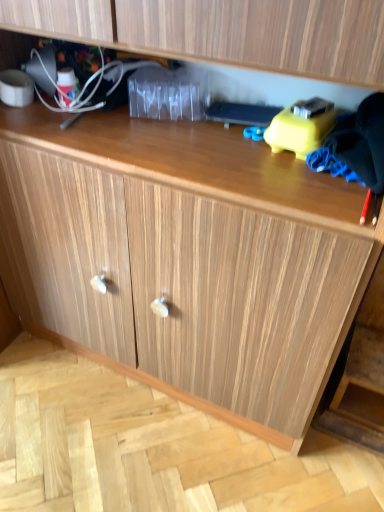
The width and height of the screenshot is (384, 512). What do you see at coordinates (356, 146) in the screenshot? I see `black fabric at right` at bounding box center [356, 146].

I want to click on black fabric at right, so click(x=356, y=146).

What are the coordinates of `yellow plastic toy at upper right` in the screenshot? It's located at (301, 127).

Describe the element at coordinates (301, 127) in the screenshot. I see `yellow plastic toy at upper right` at that location.

Where is `black fabric at right`? The image size is (384, 512). black fabric at right is located at coordinates (356, 146).

Can you confirm if black fabric at right is positioned to the right of yellow plastic toy at upper right?

Indeed, black fabric at right is positioned on the right side of yellow plastic toy at upper right.

Considering the positions of objects black fabric at right and yellow plastic toy at upper right in the image provided, who is behind, black fabric at right or yellow plastic toy at upper right?

yellow plastic toy at upper right is more distant.

Considering the positions of point (339, 118) and point (317, 106), is point (339, 118) closer or farther from the camera than point (317, 106)?

Clearly, point (339, 118) is more distant from the camera than point (317, 106).

From the image's perspective, who appears lower, black fabric at right or yellow plastic toy at upper right?

From the image's view, black fabric at right is below.

From a real-world perspective, which object rests below the other?

yellow plastic toy at upper right is physically lower.

Can you confirm if black fabric at right is thinner than yellow plastic toy at upper right?

In fact, black fabric at right might be wider than yellow plastic toy at upper right.

Does black fabric at right have a greater height compared to yellow plastic toy at upper right?

Yes, black fabric at right is taller than yellow plastic toy at upper right.

Can you confirm if black fabric at right is bigger than yellow plastic toy at upper right?

Correct, black fabric at right is larger in size than yellow plastic toy at upper right.

Do you think black fabric at right is within yellow plastic toy at upper right, or outside of it?

black fabric at right cannot be found inside yellow plastic toy at upper right.

Is black fabric at right positioned far away from yellow plastic toy at upper right?

Actually, black fabric at right and yellow plastic toy at upper right are a little close together.

Is black fabric at right turned away from yellow plastic toy at upper right?

black fabric at right does not have its back to yellow plastic toy at upper right.

Where is `clothing that appears on the right of yellow plastic toy at upper right`? The width and height of the screenshot is (384, 512). clothing that appears on the right of yellow plastic toy at upper right is located at coordinates (356, 146).

Can you confirm if yellow plastic toy at upper right is positioned to the left of black fabric at right?

Yes, yellow plastic toy at upper right is to the left of black fabric at right.

Which object is more forward, yellow plastic toy at upper right or black fabric at right?

black fabric at right is in front.

Considering the points (286, 111) and (382, 108), which point is behind, point (286, 111) or point (382, 108)?

The point (286, 111) is farther from the camera.

From the image's perspective, is yellow plastic toy at upper right beneath black fabric at right?

No, from the image's perspective, yellow plastic toy at upper right is not below black fabric at right.

From a real-world perspective, is yellow plastic toy at upper right over black fabric at right?

No, from a real-world perspective, yellow plastic toy at upper right is not over black fabric at right

Which object is wider, yellow plastic toy at upper right or black fabric at right?

black fabric at right.

Considering the sizes of objects yellow plastic toy at upper right and black fabric at right in the image provided, who is taller, yellow plastic toy at upper right or black fabric at right?

black fabric at right.

Looking at the image, does yellow plastic toy at upper right seem bigger or smaller compared to black fabric at right?

In the image, yellow plastic toy at upper right appears to be smaller than black fabric at right.

Would you say yellow plastic toy at upper right is inside or outside black fabric at right?

yellow plastic toy at upper right cannot be found inside black fabric at right.

Is there a large distance between yellow plastic toy at upper right and black fabric at right?

They are positioned close to each other.

Is yellow plastic toy at upper right oriented away from black fabric at right?

No, yellow plastic toy at upper right's orientation is not away from black fabric at right.

Image resolution: width=384 pixels, height=512 pixels. In order to click on toy lying above the black fabric at right (from the image's perspective) in this screenshot , I will do `click(301, 127)`.

The width and height of the screenshot is (384, 512). Find the location of `toy below the black fabric at right (from a real-world perspective)`. toy below the black fabric at right (from a real-world perspective) is located at coordinates (301, 127).

I want to click on clothing that is in front of the yellow plastic toy at upper right, so click(356, 146).